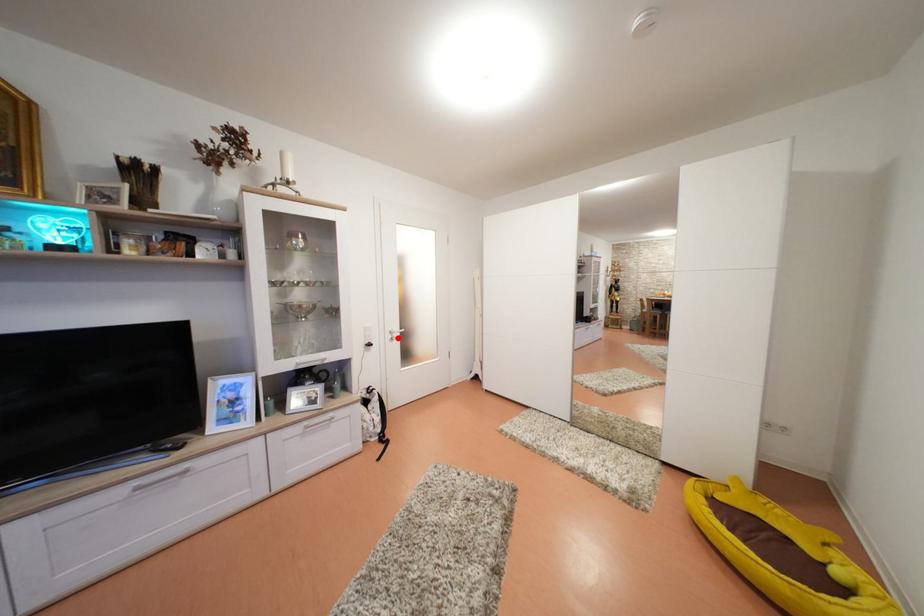
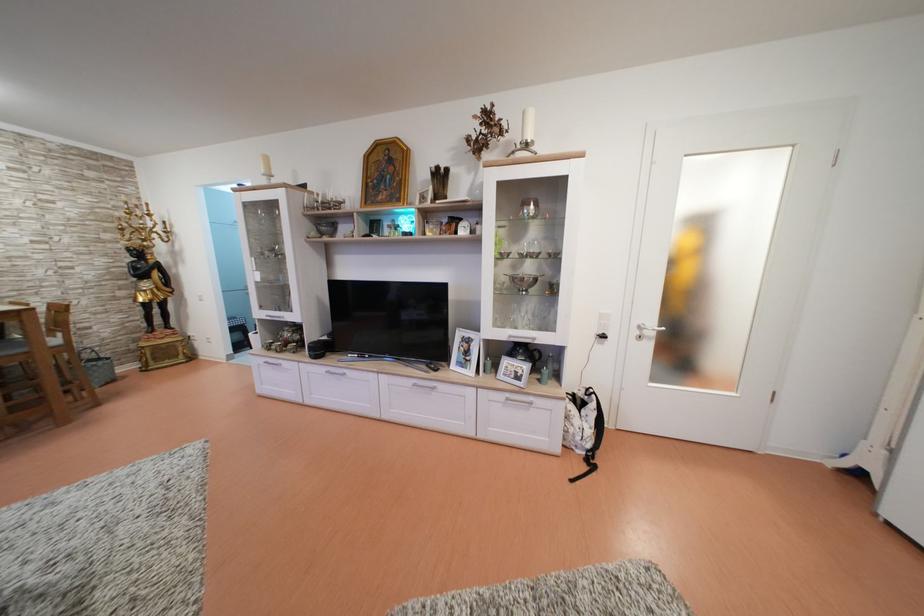
Question: I am providing you with two images of the same scene from different viewpoints. Image1 has a red point marked. In image2, the corresponding 3D location appears at what relative position? Reply with the corresponding letter.

Choices:
 (A) Closer
 (B) Farther

Answer: (A)